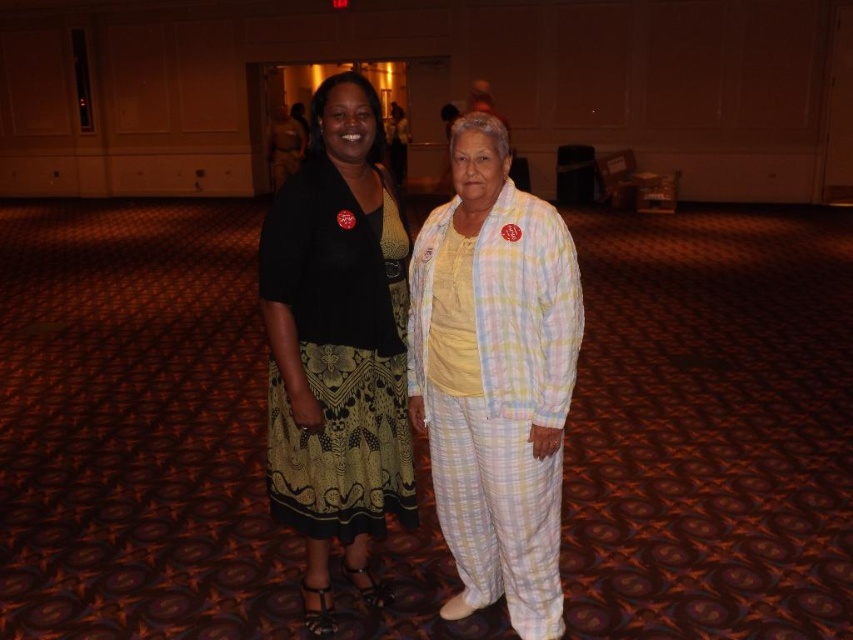
The width and height of the screenshot is (853, 640). What do you see at coordinates (337, 342) in the screenshot? I see `matte black skirt at center` at bounding box center [337, 342].

Is point (325, 132) farther from camera compared to point (292, 176)?

No.

I want to click on matte black skirt at center, so click(337, 342).